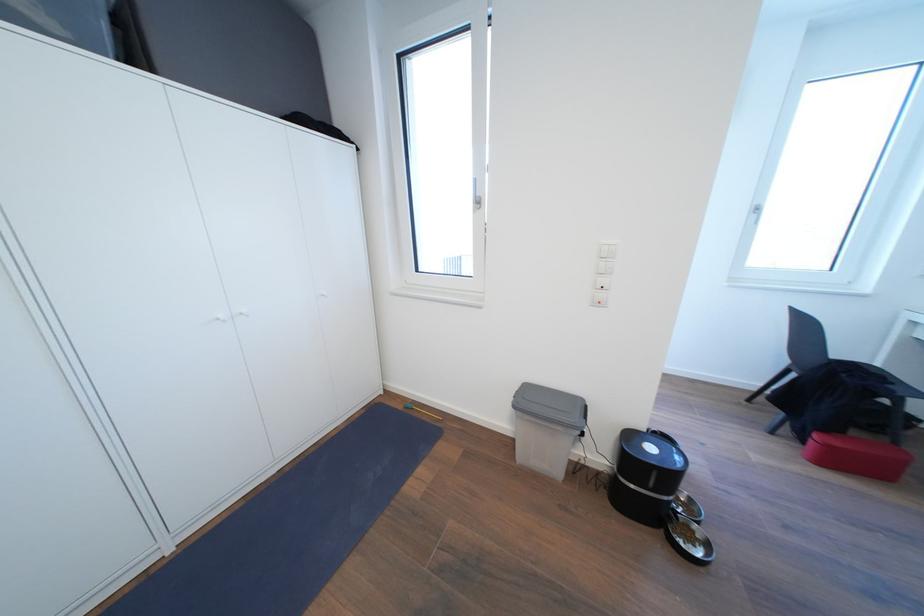
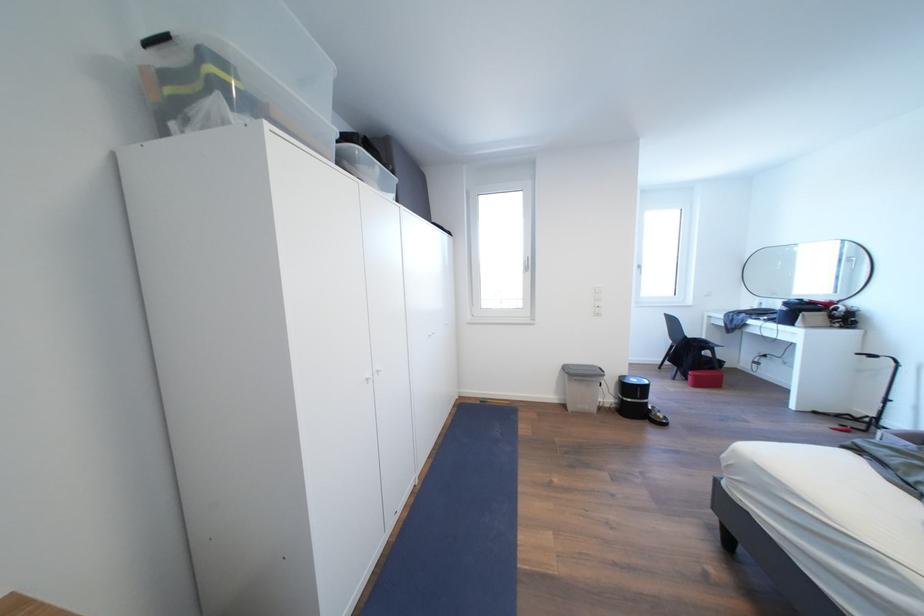
In the second image, find the point that corresponds to (835,451) in the first image.

(703, 381)